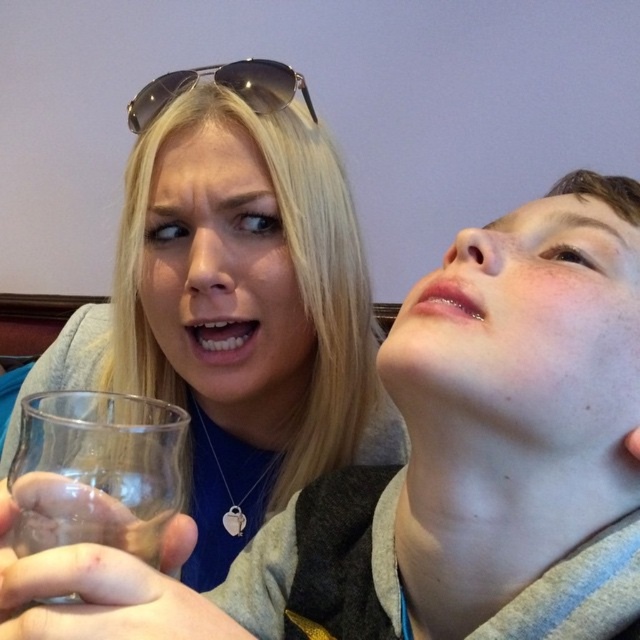
Question: Among these points, which one is farthest from the camera?

Choices:
 (A) (284, 108)
 (B) (164, 518)

Answer: (A)

Question: Which of the following is the farthest from the observer?

Choices:
 (A) [138, 435]
 (B) [228, 129]

Answer: (B)

Question: Which point appears closest to the camera in this image?

Choices:
 (A) (266, 77)
 (B) (129, 449)

Answer: (B)

Question: Where is clear glass at left located in relation to metallic aviator sunglasses at upper center in the image?

Choices:
 (A) right
 (B) left

Answer: (A)

Question: Is transparent glass at lower left to the right of metallic aviator sunglasses at upper center from the viewer's perspective?

Choices:
 (A) no
 (B) yes

Answer: (B)

Question: Can you confirm if clear glass at left is positioned to the right of metallic aviator sunglasses at upper center?

Choices:
 (A) no
 (B) yes

Answer: (B)